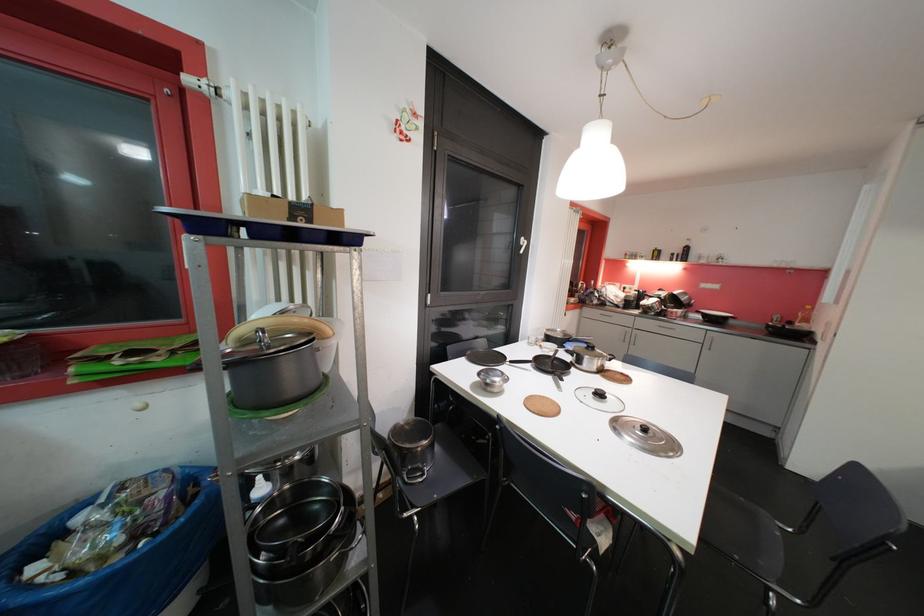
Find where to lift the pot handle. Please return your answer as a coordinate pair (x, y).

(359, 538)